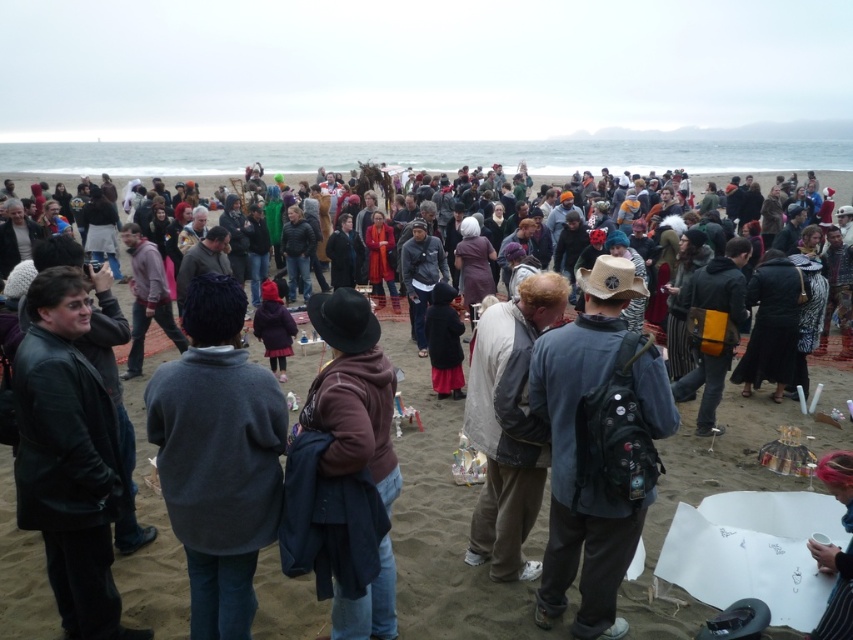
You are a photographer at the beach event and want to capture a photo of the matte black jacket at center. Where should you aim your camera to ensure the jacket is centered in the photo?

You should aim your camera at the point with coordinates (x=442, y=524) to center the matte black jacket at center in the photo.